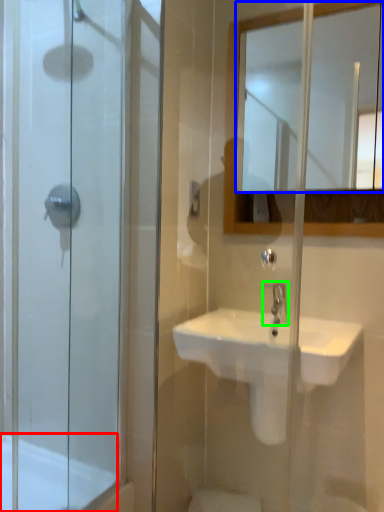
Question: Considering the real-world distances, which object is closest to bath (highlighted by a red box)? mirror (highlighted by a blue box) or tap (highlighted by a green box).

Choices:
 (A) mirror
 (B) tap

Answer: (B)